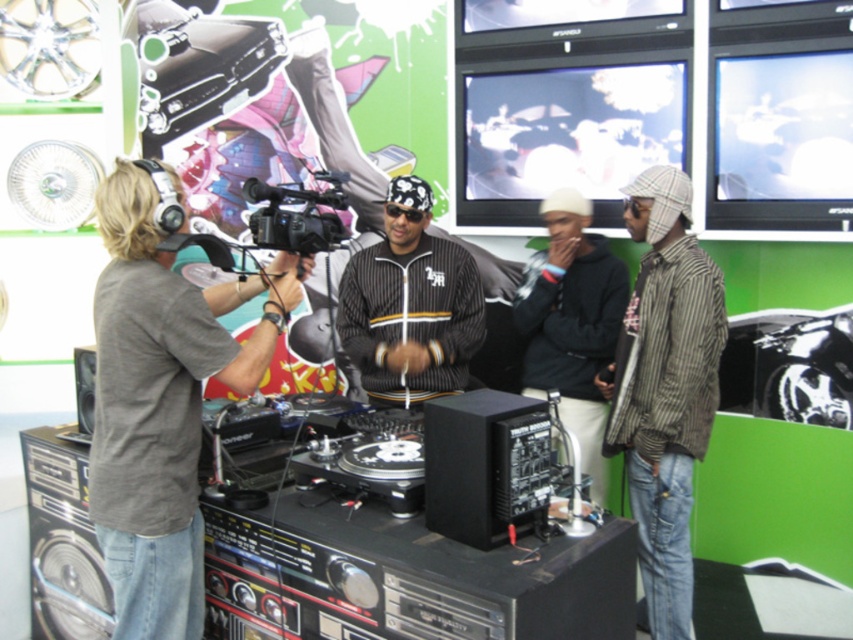
Question: Which object is positioned closest to the gray cotton shirt at left?

Choices:
 (A) striped cotton shirt at right
 (B) black pinstripe jacket at center
 (C) black plastic video camera at center

Answer: (C)

Question: Which point is closer to the camera taking this photo?

Choices:
 (A) (270, 202)
 (B) (459, 353)
 (C) (666, 394)
 (D) (523, 284)

Answer: (A)

Question: Among these objects, which one is nearest to the camera?

Choices:
 (A) gray cotton shirt at left
 (B) black matte hoodie at center

Answer: (A)

Question: From the image, what is the correct spatial relationship of black pinstripe jacket at center in relation to black matte hoodie at center?

Choices:
 (A) right
 (B) left

Answer: (B)

Question: Considering the relative positions of black pinstripe jacket at center and black plastic video camera at center in the image provided, where is black pinstripe jacket at center located with respect to black plastic video camera at center?

Choices:
 (A) left
 (B) right

Answer: (B)

Question: Is black matte hoodie at center to the left of black plastic video camera at center from the viewer's perspective?

Choices:
 (A) no
 (B) yes

Answer: (A)